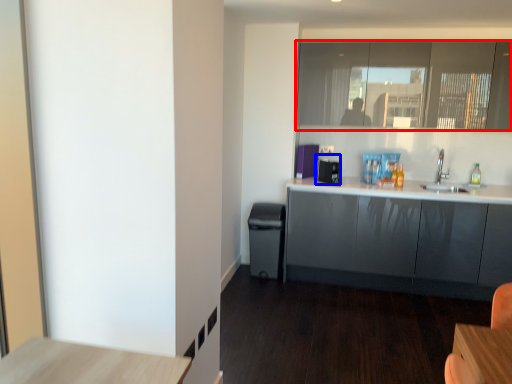
Question: Which object appears closest to the camera in this image, window (highlighted by a red box) or appliance (highlighted by a blue box)?

Choices:
 (A) window
 (B) appliance

Answer: (A)